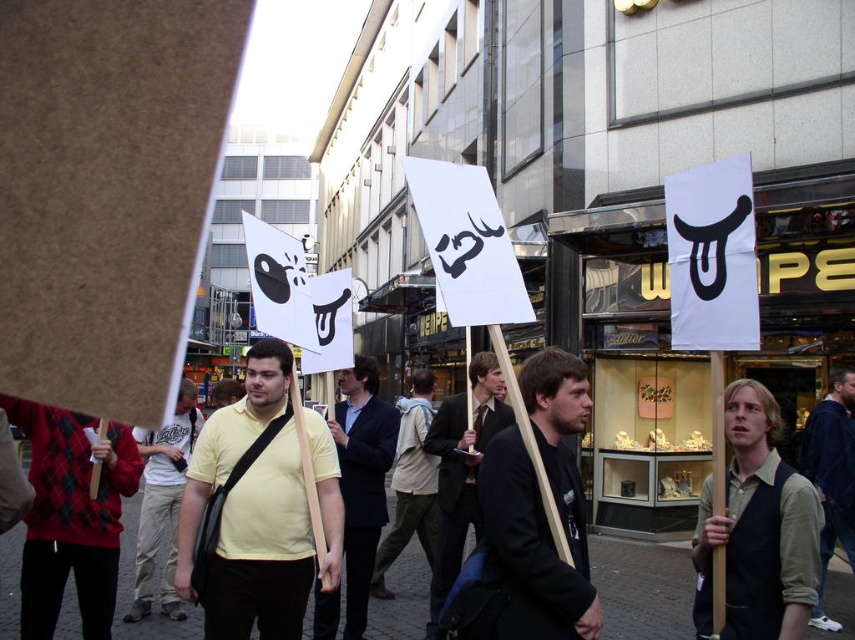
Question: Which object is farther from the camera taking this photo?

Choices:
 (A) yellow matte shirt at center
 (B) light brown cotton shirt at center

Answer: (B)

Question: Does yellow t-shirt at center appear under light beige cotton shirt at center?

Choices:
 (A) yes
 (B) no

Answer: (A)

Question: Which of the following is the closest to the observer?

Choices:
 (A) pos(789,544)
 (B) pos(516,592)
 (C) pos(845,554)

Answer: (B)

Question: Considering the real-world distances, which object is farthest from the black suit at center?

Choices:
 (A) light beige cotton shirt at center
 (B) yellow shirt at center

Answer: (B)

Question: Does yellow t-shirt at center appear on the left side of black suit at center?

Choices:
 (A) yes
 (B) no

Answer: (A)

Question: Can you confirm if black suit at center is positioned to the left of yellow shirt at center?

Choices:
 (A) yes
 (B) no

Answer: (B)